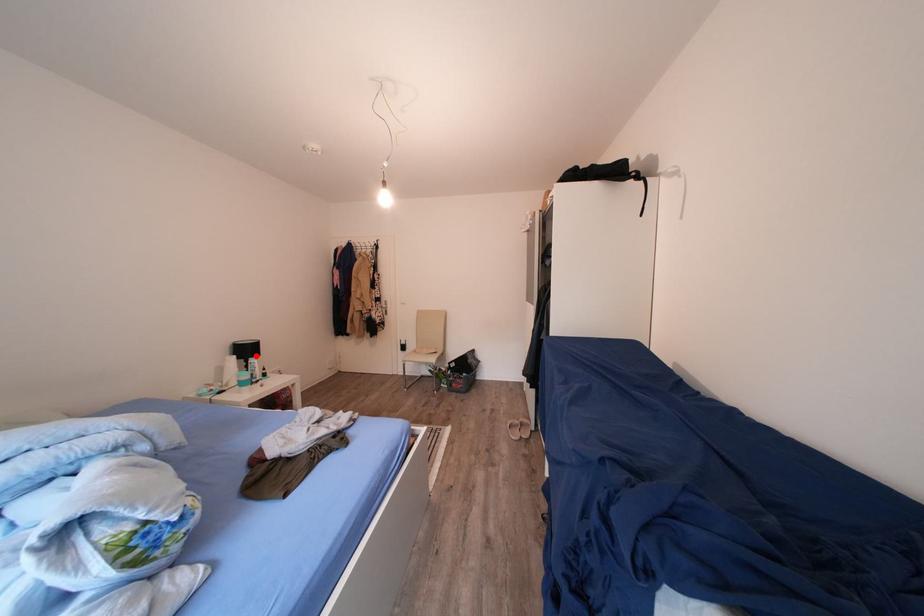
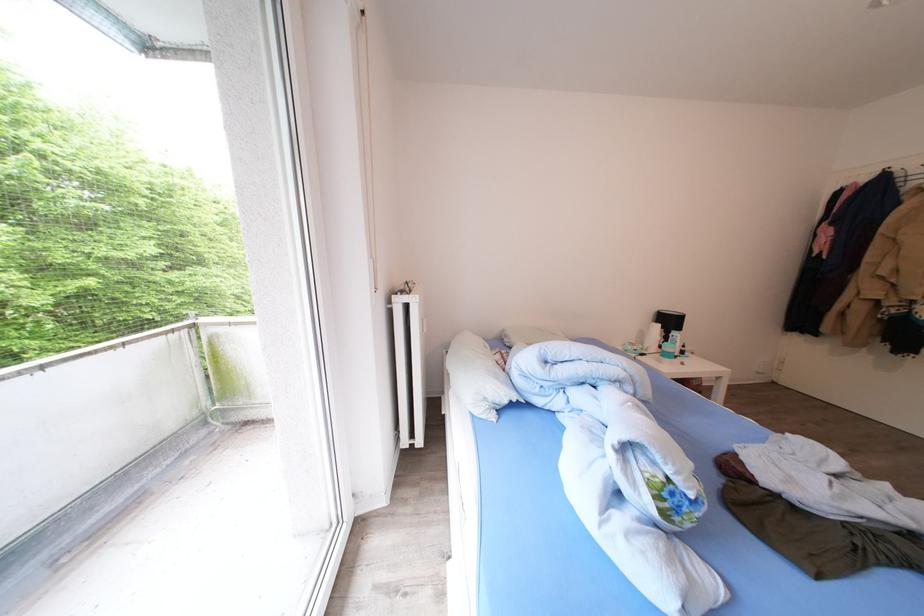
Locate, in the second image, the point that corresponds to the highlighted location in the first image.

(677, 326)